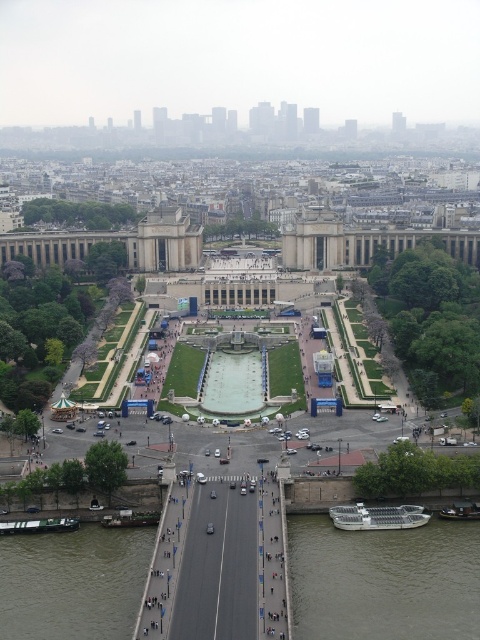
Question: Does brown murky water at lower left have a greater width compared to white plastic boat at lower left?

Choices:
 (A) yes
 (B) no

Answer: (A)

Question: Does white plastic boat at lower left appear over wooden boat at lower left?

Choices:
 (A) yes
 (B) no

Answer: (B)

Question: Estimate the real-world distances between objects in this image. Which object is closer to the white plastic boat at lower left?

Choices:
 (A) wooden boat at lower left
 (B) greenish-gray concrete boat at lower right
 (C) brown murky water at lower left

Answer: (A)

Question: Which point is farther to the camera?

Choices:
 (A) brown murky water at lower left
 (B) black rubber boat at lower right

Answer: (B)

Question: Is greenish-gray concrete boat at lower right smaller than metallic silver boat at lower right?

Choices:
 (A) no
 (B) yes

Answer: (A)

Question: Which object is farther from the camera taking this photo?

Choices:
 (A) greenish-gray concrete boat at lower right
 (B) wooden boat at lower left

Answer: (B)